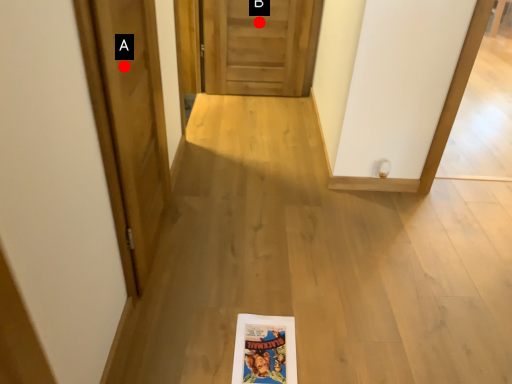
Question: Two points are circled on the image, labeled by A and B beside each circle. Which point appears farthest from the camera in this image?

Choices:
 (A) A is further
 (B) B is further

Answer: (B)